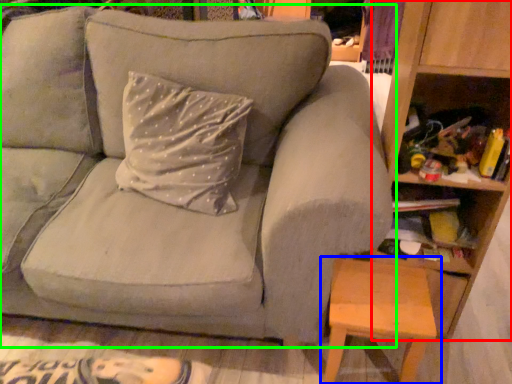
Question: Which is farther away from bookshelf (highlighted by a red box)? table (highlighted by a blue box) or studio couch (highlighted by a green box)?

Choices:
 (A) table
 (B) studio couch

Answer: (B)